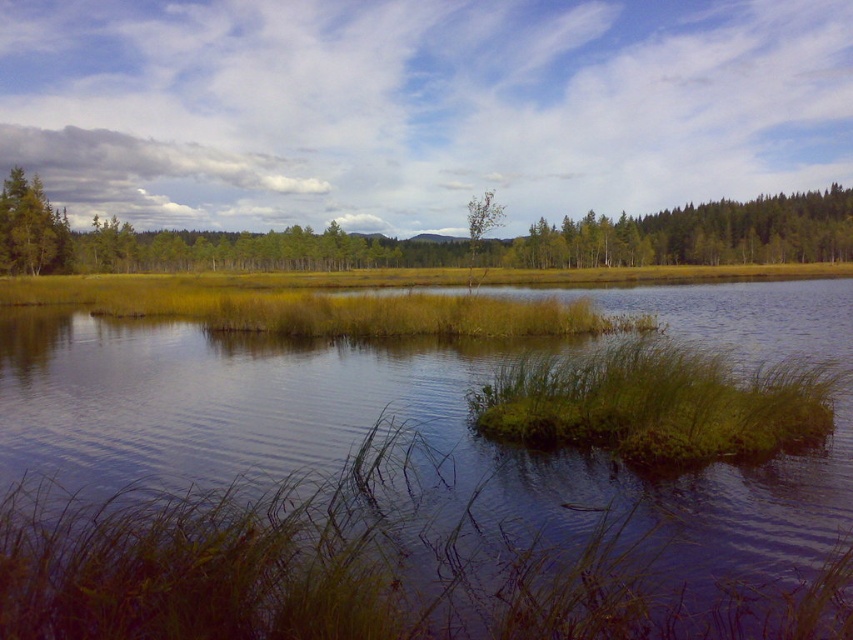
Question: Which of the following is the farthest from the observer?

Choices:
 (A) (514, 257)
 (B) (527, 481)

Answer: (A)

Question: Is green grassy lake at center behind green leafy grass at center?

Choices:
 (A) yes
 (B) no

Answer: (B)

Question: Does green leafy grass at center have a larger size compared to green leafy tree at center?

Choices:
 (A) no
 (B) yes

Answer: (A)

Question: Is green leafy grass at center behind green grass at center?

Choices:
 (A) no
 (B) yes

Answer: (A)

Question: Which point is closer to the camera?

Choices:
 (A) (810, 413)
 (B) (3, 248)
 (C) (216, 420)

Answer: (A)

Question: Which point is farther to the camera?

Choices:
 (A) (746, 237)
 (B) (485, 193)
 (C) (704, 451)

Answer: (A)